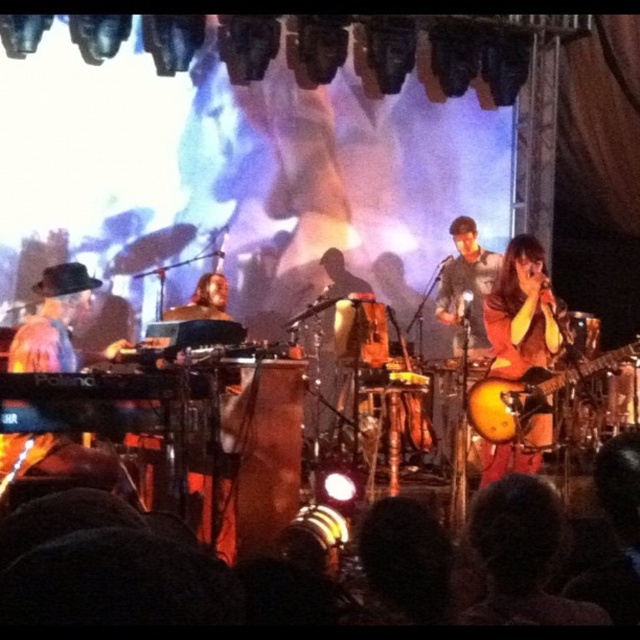
Is point (524, 337) farther from viewer compared to point (464, 284)?

No, it is not.

How much distance is there between shiny gold guitar at right and gray fabric shirt at center?

shiny gold guitar at right and gray fabric shirt at center are 1.20 meters apart from each other.

Which is behind, point (524, 365) or point (483, 280)?

Positioned behind is point (483, 280).

Image resolution: width=640 pixels, height=640 pixels. I want to click on shiny gold guitar at right, so click(x=522, y=312).

Between point (499, 348) and point (492, 422), which one is positioned behind?

The point (499, 348) is more distant.

Is shiny gold guitar at right taller than glossy wood guitar at right?

Correct, shiny gold guitar at right is much taller as glossy wood guitar at right.

Measure the distance between point [518,246] and camera.

Point [518,246] is 4.02 meters from camera.

At what (x,y) coordinates should I click in order to perform the action: click on shiny gold guitar at right. Please return your answer as a coordinate pair (x, y). The height and width of the screenshot is (640, 640). Looking at the image, I should click on (522, 312).

Consider the image. Can you confirm if glossy wood guitar at right is taller than gray fabric shirt at center?

In fact, glossy wood guitar at right may be shorter than gray fabric shirt at center.

Which is above, glossy wood guitar at right or gray fabric shirt at center?

gray fabric shirt at center

The image size is (640, 640). Identify the location of glossy wood guitar at right. (531, 400).

At what (x,y) coordinates should I click in order to perform the action: click on glossy wood guitar at right. Please return your answer as a coordinate pair (x, y). Image resolution: width=640 pixels, height=640 pixels. Looking at the image, I should click on (531, 400).